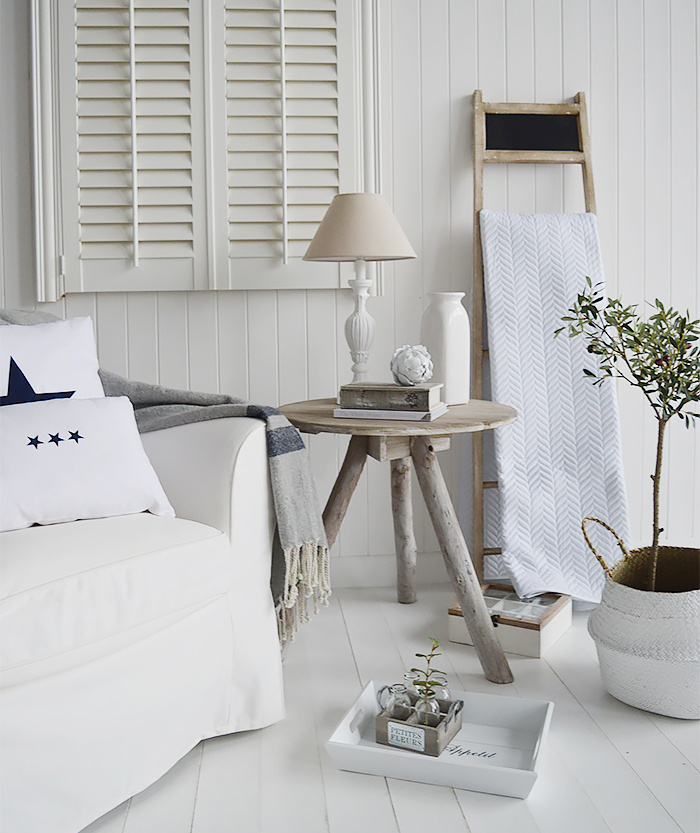
This screenshot has width=700, height=833. What are the coordinates of `shutter blinds` in the screenshot? It's located at (157, 167), (260, 87).